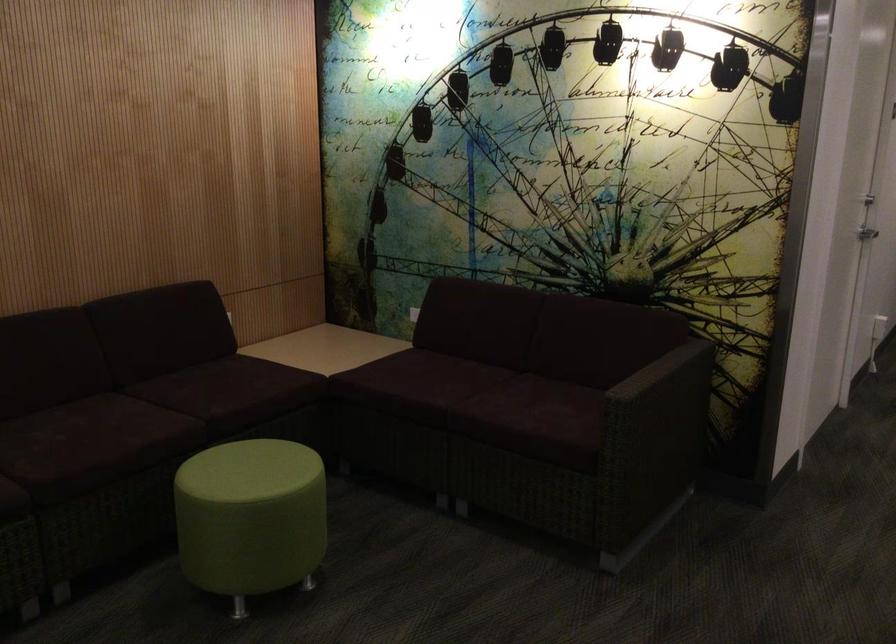
Find the location of a particular element. This screenshot has width=896, height=644. white light switch is located at coordinates (412, 314).